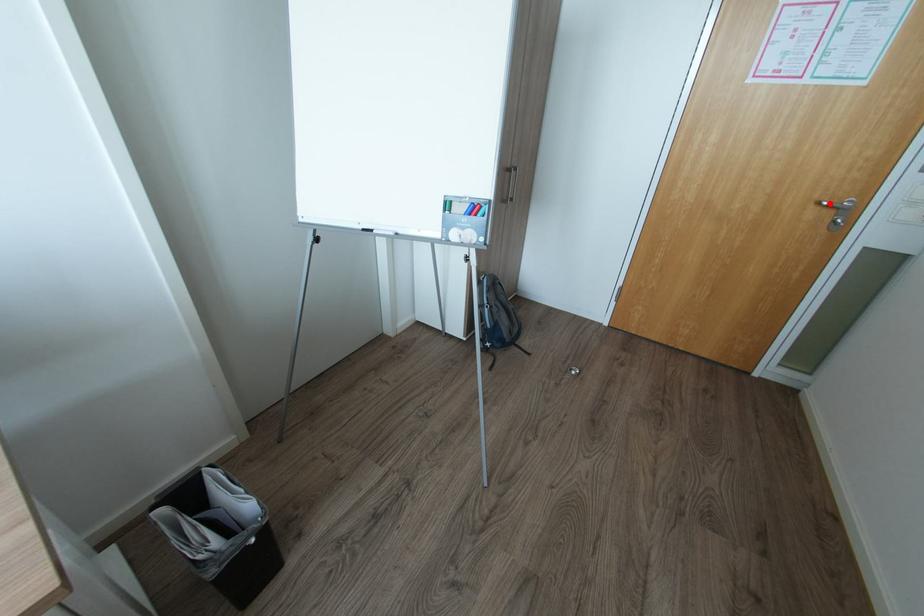
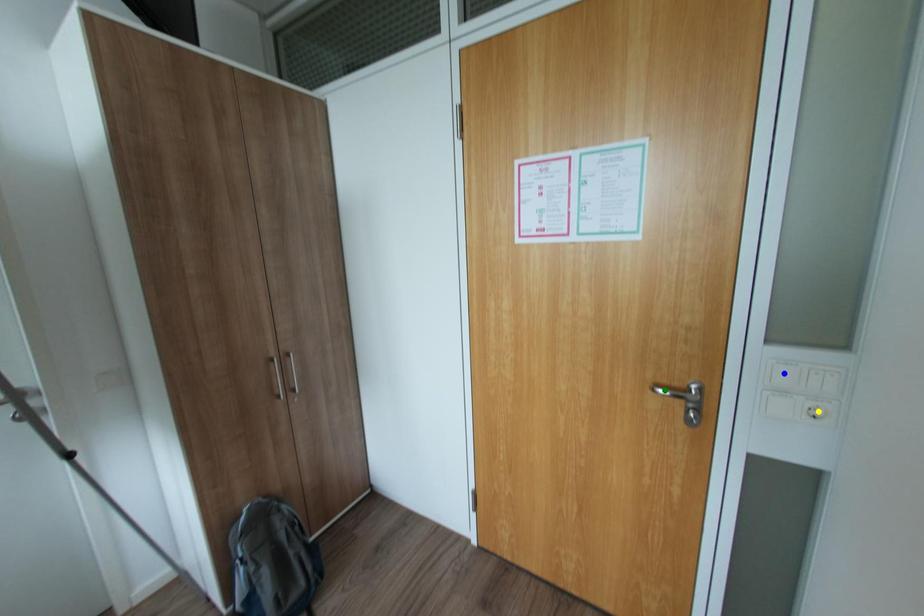
Question: I am providing you with two images of the same scene from different viewpoints. A red point is marked on the first image. You are given multiple points on the second image. Which point in image 2 represents the same 3d spot as the red point in image 1?

Choices:
 (A) green point
 (B) blue point
 (C) yellow point

Answer: (A)